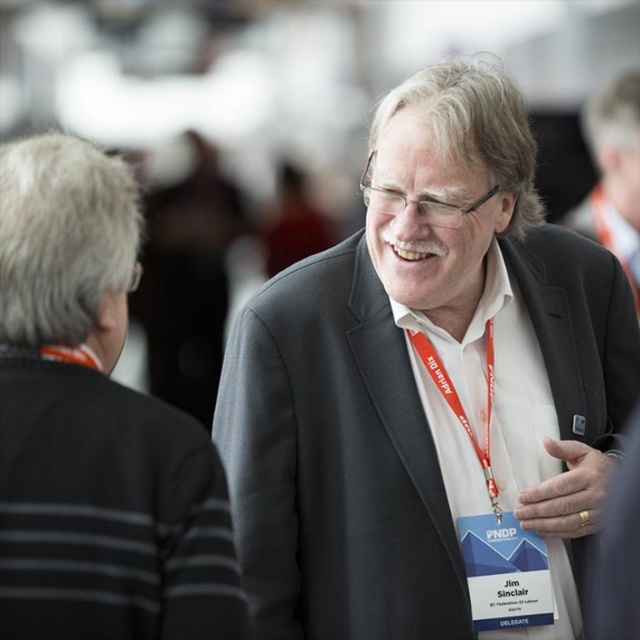
Question: Is the position of gray suit at center more distant than that of dark gray suit at center?

Choices:
 (A) yes
 (B) no

Answer: (A)

Question: Does gray suit at center appear on the right side of dark gray suit at center?

Choices:
 (A) no
 (B) yes

Answer: (B)

Question: Is gray suit at center positioned at the back of dark gray suit at center?

Choices:
 (A) no
 (B) yes

Answer: (B)

Question: Which of the following is the closest to the observer?

Choices:
 (A) dark gray suit at center
 (B) gray suit at center

Answer: (A)

Question: Among these points, which one is nearest to the camera?

Choices:
 (A) (92, 308)
 (B) (291, 632)

Answer: (A)

Question: Among these points, which one is nearest to the camera?

Choices:
 (A) (410, 257)
 (B) (4, 554)

Answer: (B)